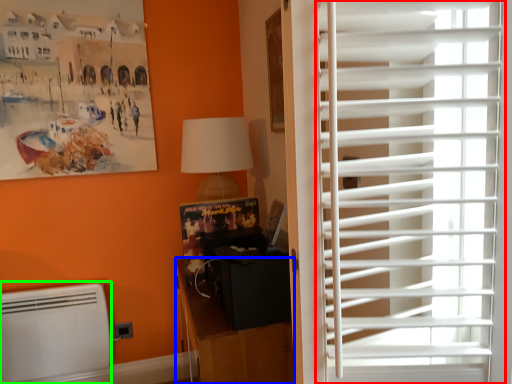
Question: Which object is positioned closest to window blind (highlighted by a red box)? Select from furniture (highlighted by a blue box) and air conditioning (highlighted by a green box).

Choices:
 (A) furniture
 (B) air conditioning

Answer: (A)